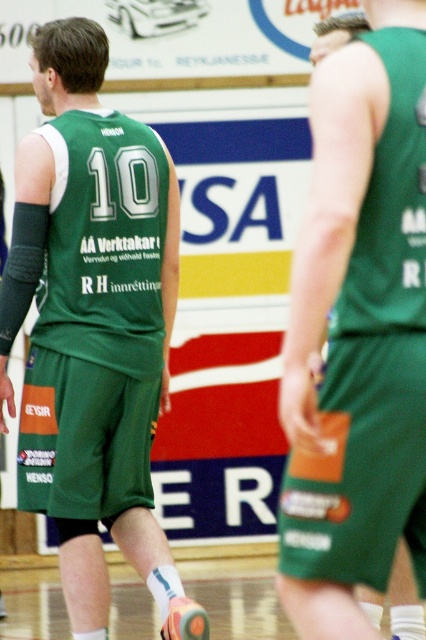
How much distance is there between green matte jersey at center and green matte shorts at center?

green matte jersey at center is 9.21 feet from green matte shorts at center.

Identify the location of green matte jersey at center. The height and width of the screenshot is (640, 426). (94, 326).